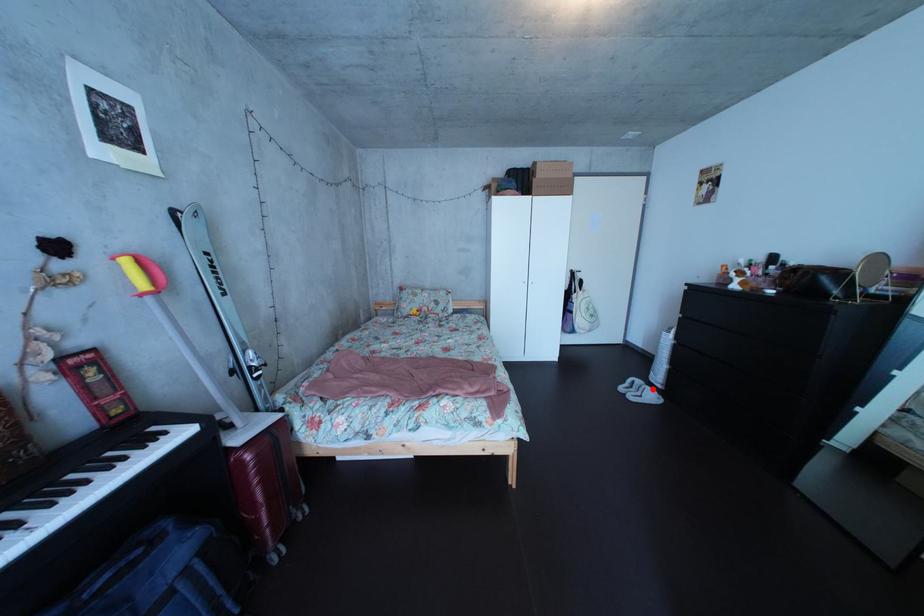
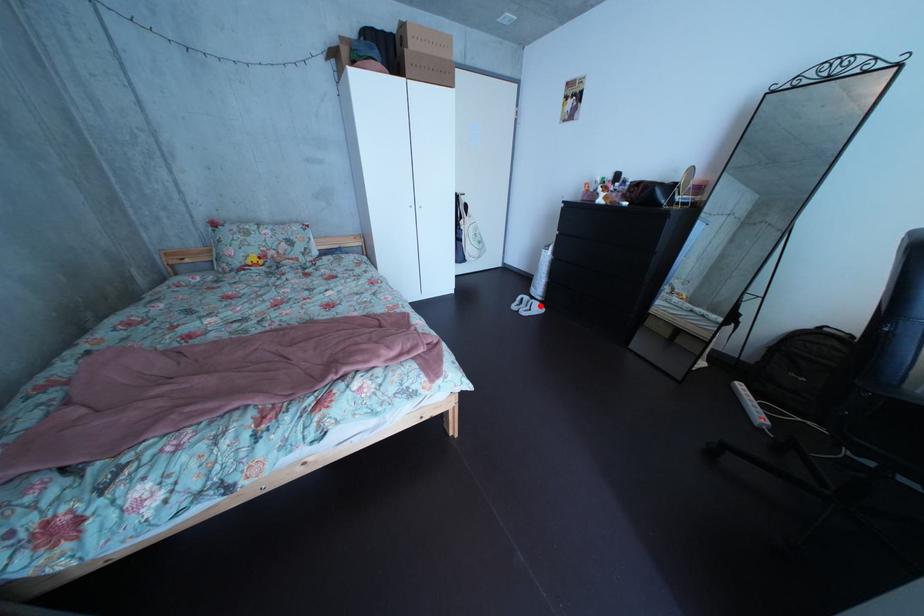
I am providing you with two images of the same scene from different viewpoints. A red point is marked on the first image and another point is marked on the second image. Is the red point in image1 aligned with the point shown in image2?

Yes